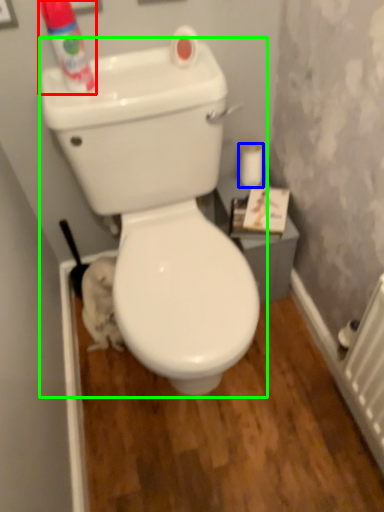
Question: Estimate the real-world distances between objects in this image. Which object is farther from cleaning product (highlighted by a red box), toilet paper (highlighted by a blue box) or toilet (highlighted by a green box)?

Choices:
 (A) toilet paper
 (B) toilet

Answer: (A)